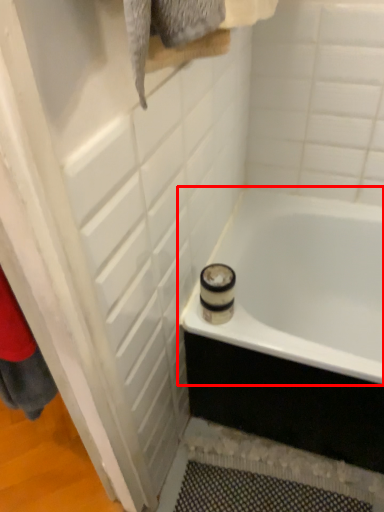
Question: From the image's perspective, considering the relative positions of bathtub (annotated by the red box) and screen door in the image provided, where is bathtub (annotated by the red box) located with respect to the staircase?

Choices:
 (A) above
 (B) below

Answer: (B)